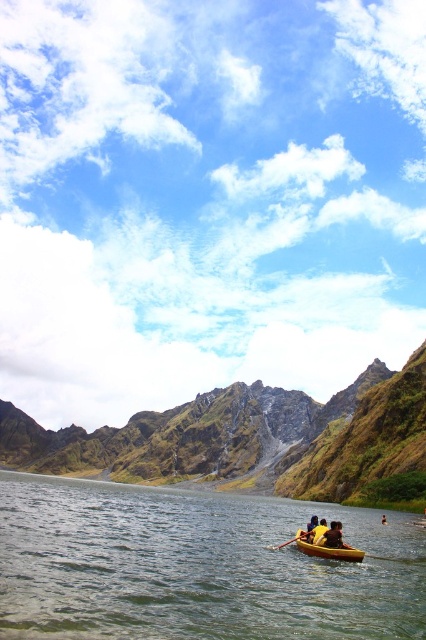
Is yellow plastic boat at center above yellow fabric person at center?

Yes.

Does yellow plastic boat at center have a lesser width compared to yellow fabric person at center?

Indeed, yellow plastic boat at center has a lesser width compared to yellow fabric person at center.

Identify the location of yellow plastic boat at center. Image resolution: width=426 pixels, height=640 pixels. (333, 536).

You are a GUI agent. You are given a task and a screenshot of the screen. Output one action in this format:
    pyautogui.click(x=<x>, y=<y>)
    Task: Click on the yellow plastic boat at center
    The height and width of the screenshot is (640, 426).
    Given the screenshot: What is the action you would take?
    pyautogui.click(x=333, y=536)

Is rugged rock mountain at center positioned before yellow matte boat at lower center?

That is False.

Between rugged rock mountain at center and yellow matte boat at lower center, which one appears on the left side from the viewer's perspective?

From the viewer's perspective, rugged rock mountain at center appears more on the left side.

Identify the location of rugged rock mountain at center. (247, 436).

Find the location of a particular element. rugged rock mountain at center is located at coordinates (247, 436).

Is rugged rock mountain at center positioned in front of yellow wood paddle at center?

No.

Is rugged rock mountain at center to the left of yellow wood paddle at center from the viewer's perspective?

Indeed, rugged rock mountain at center is positioned on the left side of yellow wood paddle at center.

Find the location of `rugged rock mountain at center`. rugged rock mountain at center is located at coordinates (247, 436).